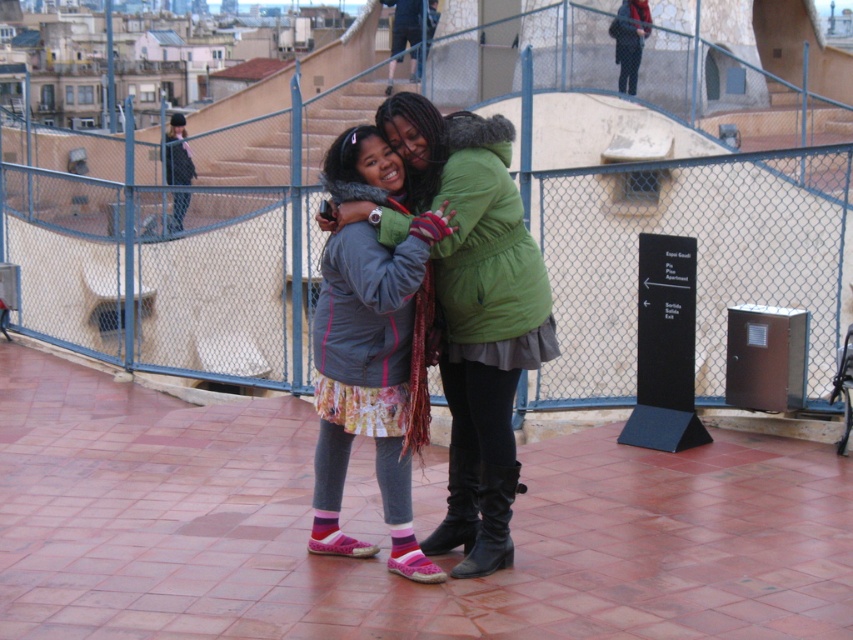
Question: Is blue wire mesh at center to the right of matte gray jacket at center from the viewer's perspective?

Choices:
 (A) no
 (B) yes

Answer: (A)

Question: Which of the following is the closest to the observer?

Choices:
 (A) (570, 13)
 (B) (440, 524)

Answer: (B)

Question: Which of the following is the closest to the observer?

Choices:
 (A) (282, 371)
 (B) (335, 388)
 (C) (442, 547)
 (D) (491, 500)

Answer: (D)

Question: Does matte gray jacket at center appear on the right side of black leather boot at center?

Choices:
 (A) no
 (B) yes

Answer: (A)

Question: Observing the image, what is the correct spatial positioning of matte gray jacket at center in reference to black leather boot at lower center?

Choices:
 (A) left
 (B) right

Answer: (A)

Question: Which of the following is the farthest from the observer?

Choices:
 (A) (91, 154)
 (B) (479, 557)
 (C) (440, 528)
 (D) (346, 394)

Answer: (A)